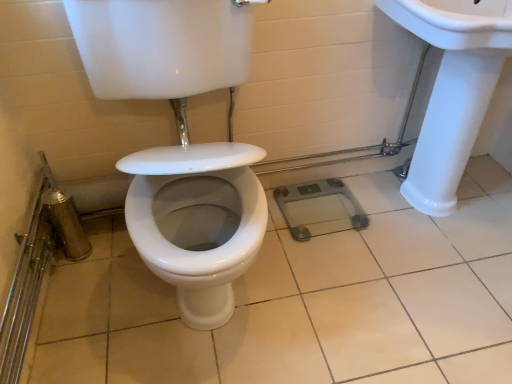
Where is `blank space situated above white glossy tile at center (from a real-world perspective)`? blank space situated above white glossy tile at center (from a real-world perspective) is located at coordinates (328, 294).